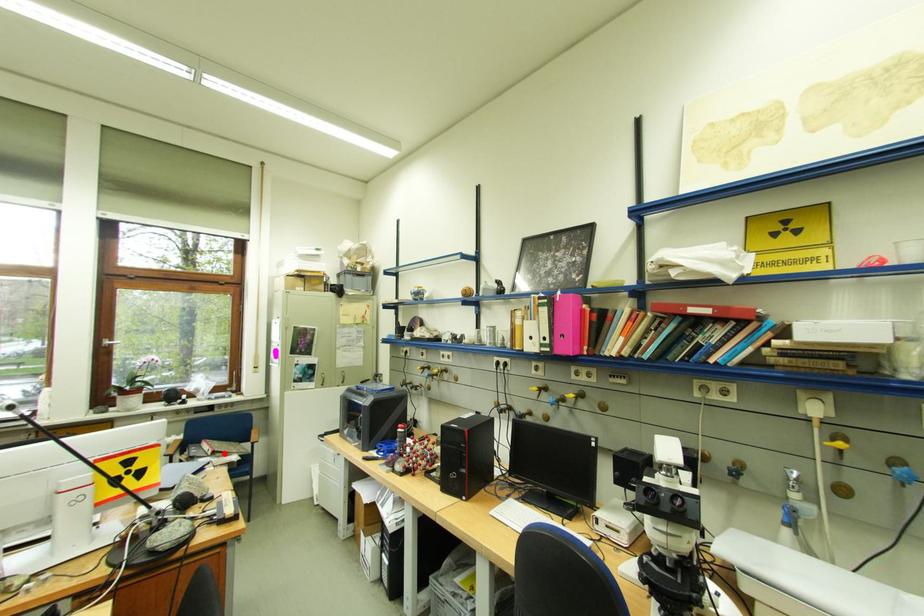
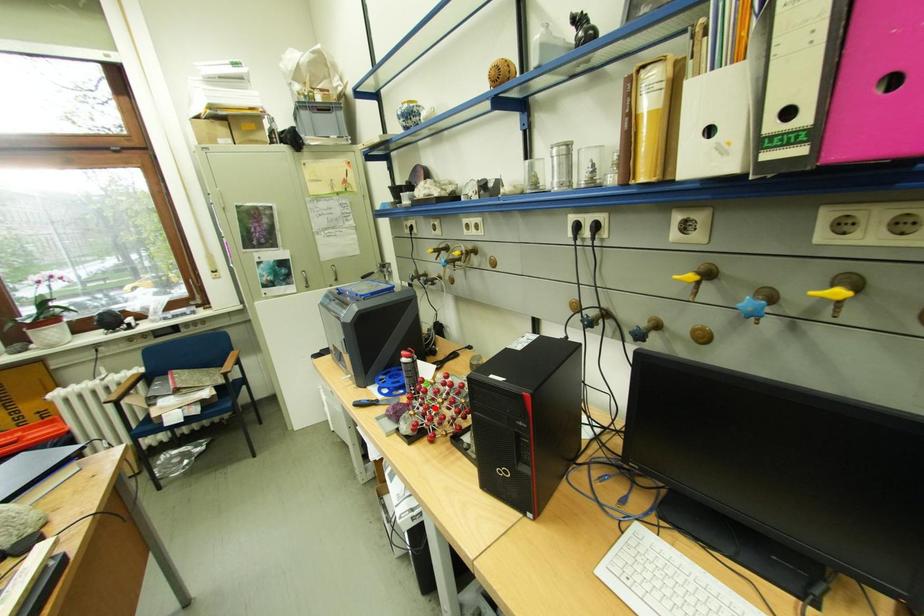
I am providing you with two images of the same scene from different viewpoints. A red point is marked on the first image and another point is marked on the second image. Do the highlighted points in image1 and image2 indicate the same real-world spot?

No